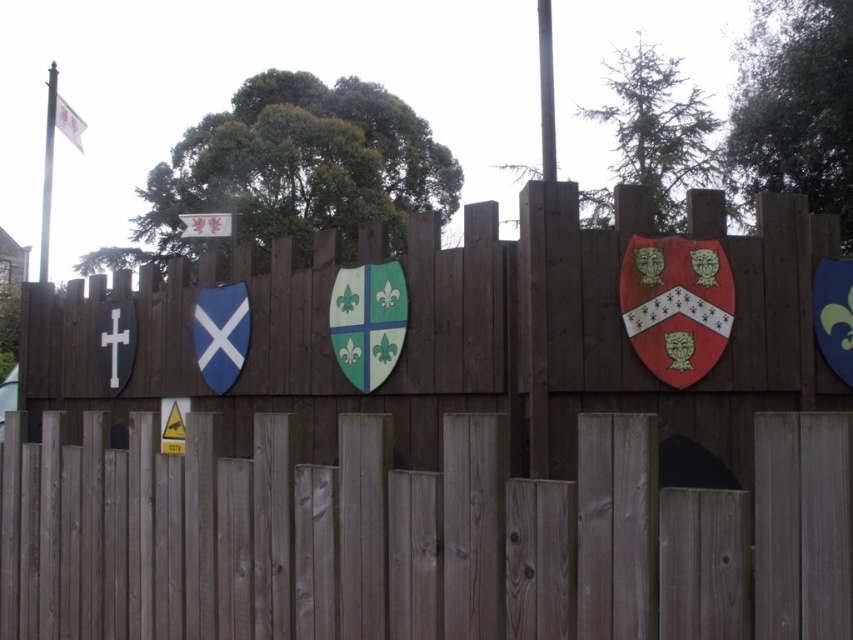
You are an archer standing at the base of the wooden fence. You need to aim your arrow at the red glossy shield at center without hitting the metallic flagpole at upper left. Based on their sizes, which object should be easier to hit?

The red glossy shield at center occupies less space than the metallic flagpole at upper left, so the flagpole is larger and easier to hit.

From the picture: You are standing in front of the wooden fence with medieval shields. You see the brown wooden fence at center and the red glossy shield at center. Which object is positioned higher?

The red glossy shield at center is positioned higher than the brown wooden fence at center because the brown wooden fence at center is located below it.